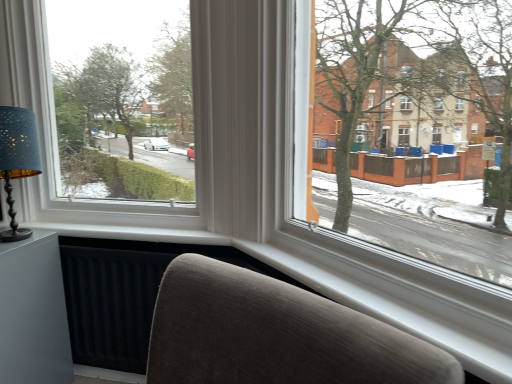
Question: Is white plastic window at upper left not within matte blue lampshade at left?

Choices:
 (A) no
 (B) yes

Answer: (B)

Question: From the image's perspective, is white plastic window at upper left located beneath matte blue lampshade at left?

Choices:
 (A) yes
 (B) no

Answer: (B)

Question: Is white plastic window at upper left oriented away from matte blue lampshade at left?

Choices:
 (A) yes
 (B) no

Answer: (A)

Question: Can you confirm if white plastic window at upper left is taller than matte blue lampshade at left?

Choices:
 (A) no
 (B) yes

Answer: (B)

Question: Is there a large distance between white plastic window at upper left and matte blue lampshade at left?

Choices:
 (A) yes
 (B) no

Answer: (B)

Question: In terms of width, does white plastic window at upper left look wider or thinner when compared to matte gray table at lower left?

Choices:
 (A) wide
 (B) thin

Answer: (A)

Question: Which is correct: white plastic window at upper left is inside matte gray table at lower left, or outside of it?

Choices:
 (A) inside
 (B) outside

Answer: (B)

Question: From their relative heights in the image, would you say white plastic window at upper left is taller or shorter than matte gray table at lower left?

Choices:
 (A) tall
 (B) short

Answer: (A)

Question: From the image's perspective, relative to matte gray table at lower left, is white plastic window at upper left above or below?

Choices:
 (A) above
 (B) below

Answer: (A)

Question: In terms of size, does matte gray table at lower left appear bigger or smaller than matte blue lampshade at left?

Choices:
 (A) small
 (B) big

Answer: (B)

Question: Relative to matte blue lampshade at left, is matte gray table at lower left in front or behind?

Choices:
 (A) behind
 (B) front

Answer: (A)

Question: From their relative heights in the image, would you say matte gray table at lower left is taller or shorter than matte blue lampshade at left?

Choices:
 (A) short
 (B) tall

Answer: (A)

Question: In terms of width, does matte gray table at lower left look wider or thinner when compared to matte blue lampshade at left?

Choices:
 (A) thin
 (B) wide

Answer: (B)

Question: Looking at their shapes, would you say matte blue lampshade at left is wider or thinner than white plastic window at upper left?

Choices:
 (A) thin
 (B) wide

Answer: (A)

Question: From a real-world perspective, is matte blue lampshade at left above or below white plastic window at upper left?

Choices:
 (A) above
 (B) below

Answer: (B)